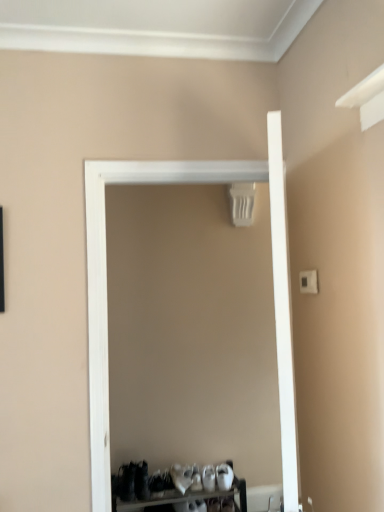
Question: From the image's perspective, is white plastic shoe rack at lower center located above or below white matte door at center?

Choices:
 (A) below
 (B) above

Answer: (A)

Question: Considering the positions of point (145, 480) and point (279, 283), is point (145, 480) closer or farther from the camera than point (279, 283)?

Choices:
 (A) farther
 (B) closer

Answer: (A)

Question: Do you think white plastic shoe rack at lower center is within white matte door at center, or outside of it?

Choices:
 (A) inside
 (B) outside

Answer: (B)

Question: Considering the relative positions of white matte door at center and white plastic shoe rack at lower center in the image provided, is white matte door at center to the left or to the right of white plastic shoe rack at lower center?

Choices:
 (A) left
 (B) right

Answer: (B)

Question: From a real-world perspective, is white matte door at center physically located above or below white plastic shoe rack at lower center?

Choices:
 (A) above
 (B) below

Answer: (A)

Question: Is white matte door at center taller or shorter than white plastic shoe rack at lower center?

Choices:
 (A) short
 (B) tall

Answer: (B)

Question: Relative to white plastic shoe rack at lower center, is white matte door at center in front or behind?

Choices:
 (A) behind
 (B) front

Answer: (B)